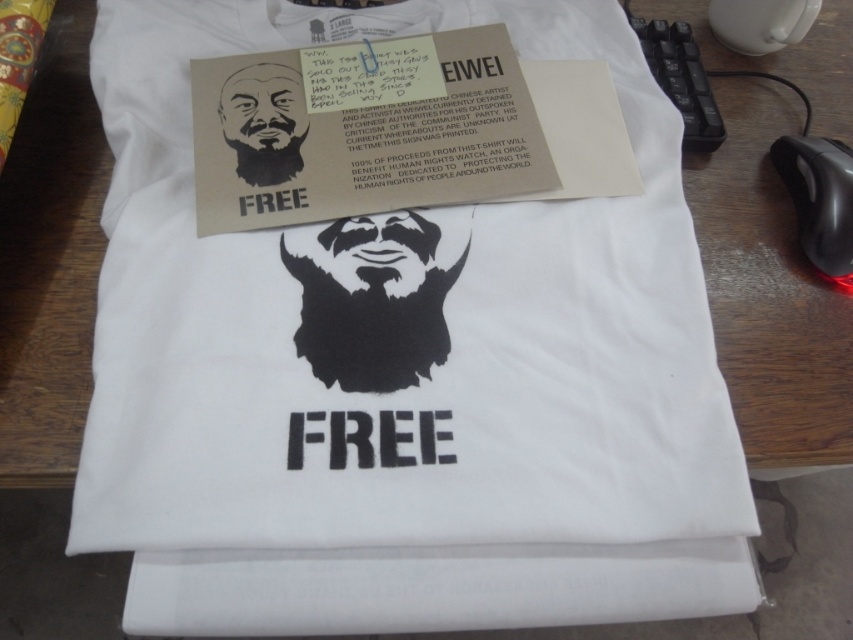
Describe the element at coordinates (393, 328) in the screenshot. I see `white matte t-shirt at center` at that location.

Identify the location of white matte t-shirt at center. The width and height of the screenshot is (853, 640). (393, 328).

The height and width of the screenshot is (640, 853). Find the location of `white matte t-shirt at center`. white matte t-shirt at center is located at coordinates (393, 328).